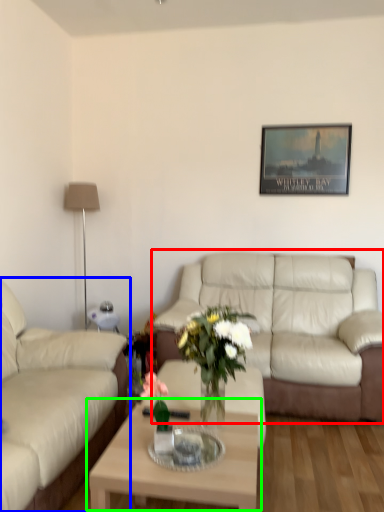
Question: Which object is the closest to the studio couch (highlighted by a red box)? Choose among these: studio couch (highlighted by a blue box) or coffee table (highlighted by a green box).

Choices:
 (A) studio couch
 (B) coffee table

Answer: (B)